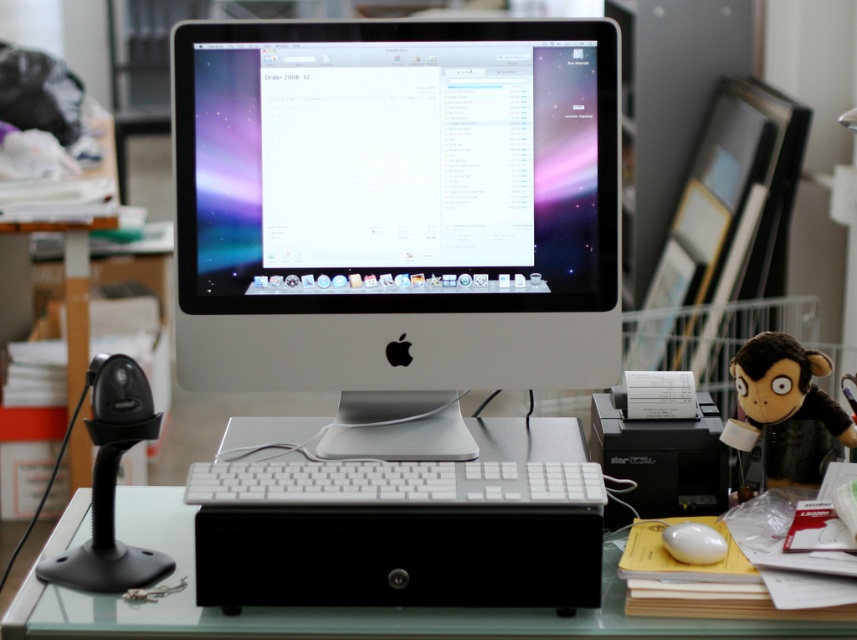
You are setting up a new workspace and need to place a small plant between the clear glass table at center and the brown plush monkey at right. According to the scene description, which object should the plant be closer to?

The plant should be placed closer to the clear glass table at center because it is located to the left of the brown plush monkey at right.

You are setting up a new workspace and want to place a small plant between the clear glass table at center and the brown plush monkey at right. Which object should the plant be placed closer to in order to ensure it is visible from the Apple iMac screen?

The plant should be placed closer to the clear glass table at center because it has a lesser height compared to the brown plush monkey at right, making it more visible from the Apple iMac screen.